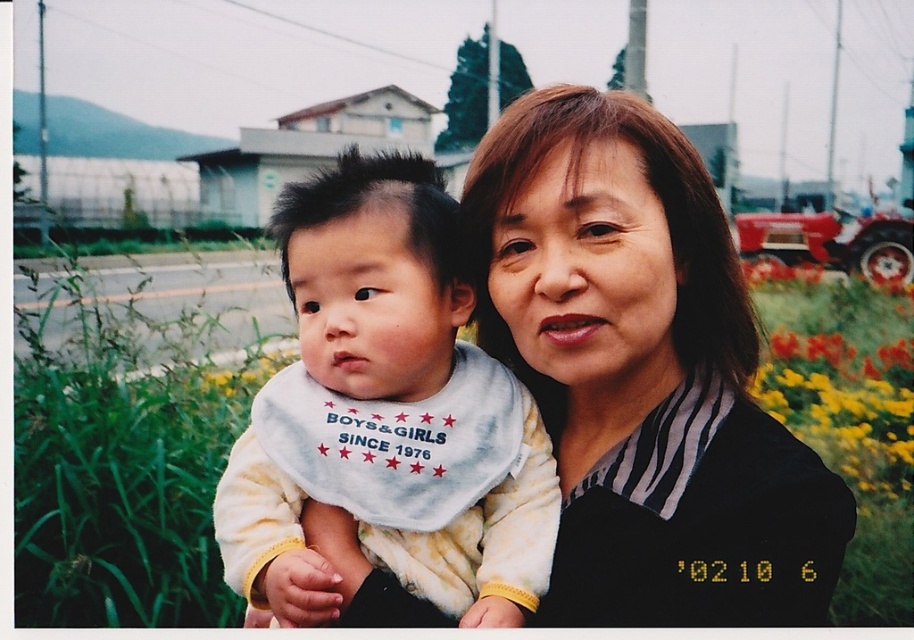
Looking at this image, you are a photographer trying to capture the white fleece bib at center in your shot. Given that your camera has a focal point at coordinates 0.5, 0.5, will the bib be centered in your photo?

The white fleece bib at center is at coordinates (392, 408), which is slightly to the right and below the camera focal point at (457, 320). Therefore, it won not be perfectly centered in the photo.

You are a photographer trying to capture the child and the adult in the scene. You notice the white fleece bib at center and the yellow fabric flower at right. Which object should you focus on first if you want to ensure both the child and the adult are in sharp focus?

The white fleece bib at center is above the yellow fabric flower at right, so focusing on the white fleece bib at center will help ensure both the child and the adult are in sharp focus since it is closer to the subject.